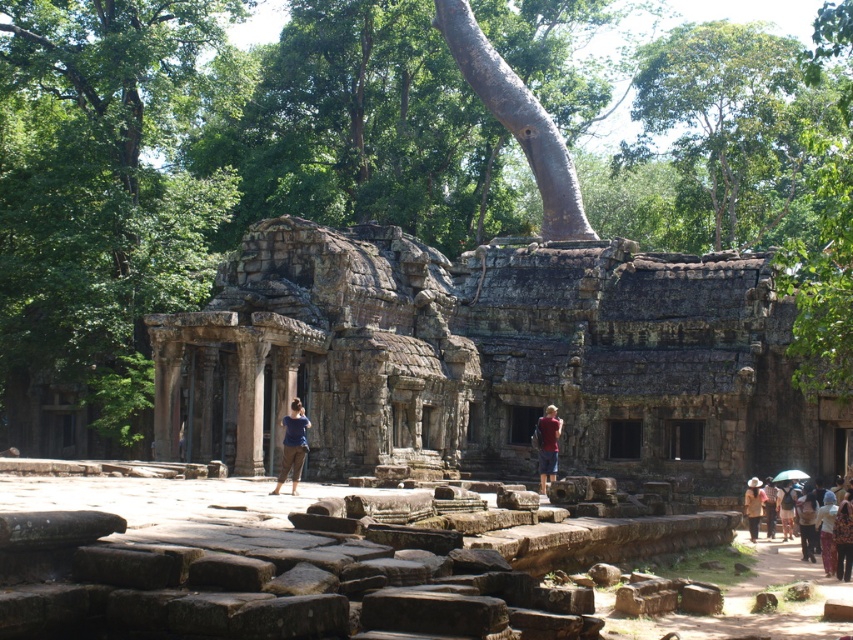
Question: Which of the following is the closest to the observer?

Choices:
 (A) brown textured dress at lower right
 (B) gray stone temple at center

Answer: (A)

Question: Does gray stone temple at center have a larger size compared to brown textured dress at lower right?

Choices:
 (A) yes
 (B) no

Answer: (A)

Question: Does gray stone temple at center appear on the right side of green leafy tree at upper center?

Choices:
 (A) yes
 (B) no

Answer: (B)

Question: Which of the following is the closest to the observer?

Choices:
 (A) (485, 460)
 (B) (822, 545)
 (C) (701, 56)

Answer: (B)

Question: Estimate the real-world distances between objects in this image. Which object is farther from the brown textured dress at lower right?

Choices:
 (A) brown textured hat at center
 (B) red shirt at center
 (C) green leafy tree at upper center
 (D) blue fabric shirt at center

Answer: (C)

Question: In this image, where is red shirt at center located relative to brown textured hat at center?

Choices:
 (A) above
 (B) below

Answer: (A)